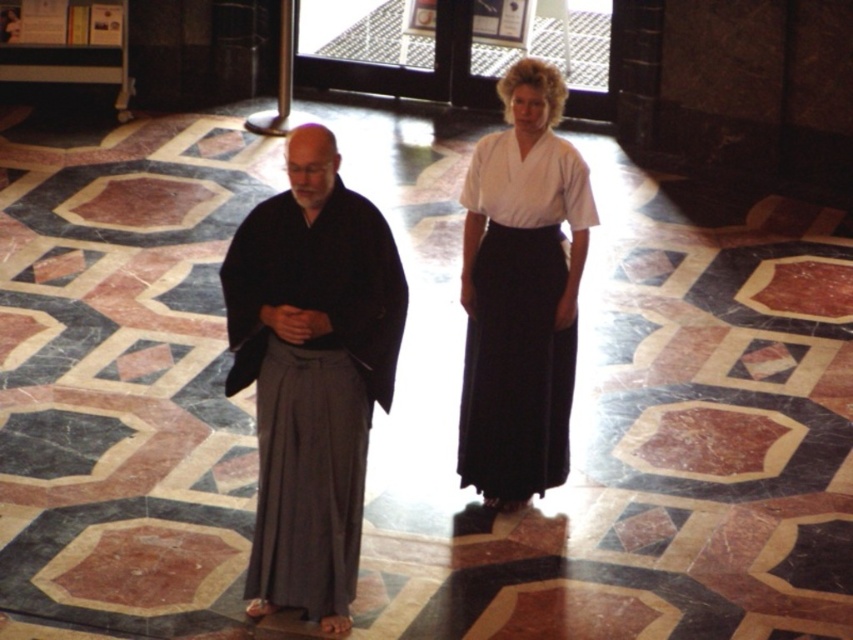
Question: Is dark gray fabric kimono at center bigger than black silk kimono at center?

Choices:
 (A) yes
 (B) no

Answer: (B)

Question: Among these points, which one is farthest from the camera?

Choices:
 (A) (462, 445)
 (B) (515, 138)
 (C) (358, 212)

Answer: (A)

Question: Among these objects, which one is nearest to the camera?

Choices:
 (A) black silk kimono at center
 (B) white cotton kimono at center
 (C) dark gray fabric kimono at center

Answer: (C)

Question: Estimate the real-world distances between objects in this image. Which object is farther from the white cotton kimono at center?

Choices:
 (A) dark gray fabric kimono at center
 (B) black silk kimono at center

Answer: (A)

Question: Does black silk kimono at center lie behind white cotton kimono at center?

Choices:
 (A) yes
 (B) no

Answer: (B)

Question: Is dark gray fabric kimono at center positioned before white cotton kimono at center?

Choices:
 (A) yes
 (B) no

Answer: (A)